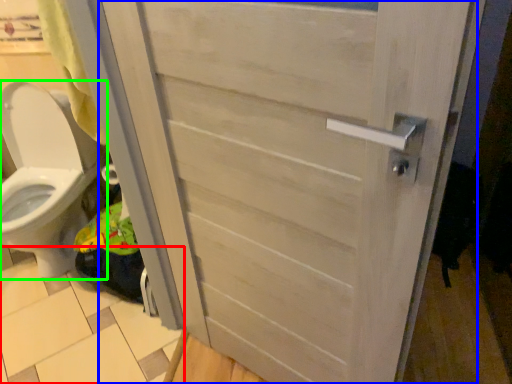
Question: Which object is positioned closest to tile (highlighted by a red box)? Select from door (highlighted by a blue box) and toilet (highlighted by a green box).

Choices:
 (A) door
 (B) toilet

Answer: (B)